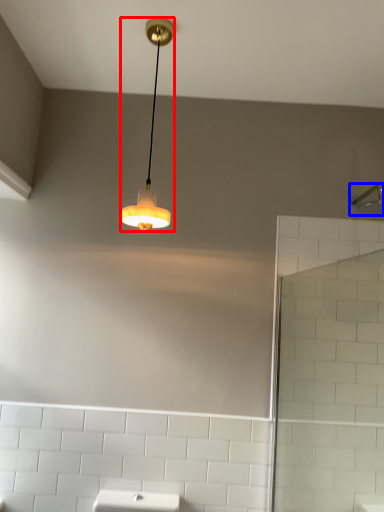
Question: Which point is further to the camera, lamp (highlighted by a red box) or shower (highlighted by a blue box)?

Choices:
 (A) lamp
 (B) shower

Answer: (B)